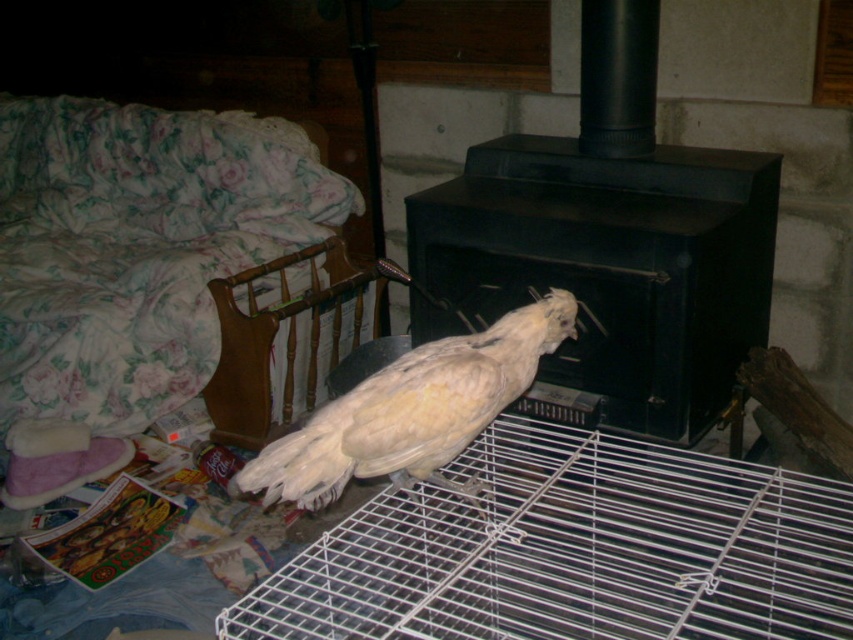
You are a small toy that needs to be placed on top of either the white wire cage at center or the black matte fireplace at center. Which object can you safely place the toy on without it falling off?

The black matte fireplace at center is taller than the white wire cage at center, so placing the toy on the black matte fireplace at center would be safer as it has a more stable and elevated surface to prevent the toy from falling off.

You are standing in the room and want to place a small plant between the two points, point (724,600) and point (416,472). Which point should the plant be closer to so it is in front of the other point?

The plant should be closer to point (416,472) because point (724,600) is behind point (416,472).